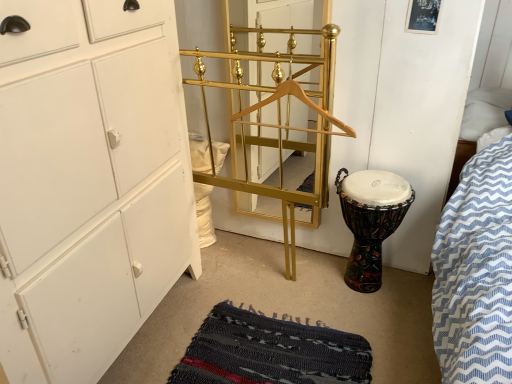
What do you see at coordinates (275, 121) in the screenshot? The width and height of the screenshot is (512, 384). I see `gold metallic coat rack at center` at bounding box center [275, 121].

This screenshot has height=384, width=512. What do you see at coordinates (302, 102) in the screenshot?
I see `wooden hanger at center` at bounding box center [302, 102].

Describe the element at coordinates (280, 28) in the screenshot. I see `gold/metallic coat rack at center` at that location.

This screenshot has width=512, height=384. What do you see at coordinates (367, 238) in the screenshot?
I see `multicolored painted drum at lower right` at bounding box center [367, 238].

At what (x,y) coordinates should I click in order to perform the action: click on rag-textured mat at lower center. Please return your answer as a coordinate pair (x, y). This screenshot has width=512, height=384. Looking at the image, I should click on (270, 352).

Locate an element on the screen. Image resolution: width=512 pixels, height=384 pixels. white matte cabinet at left is located at coordinates (89, 183).

Which is behind, gold metallic coat rack at center or multicolored painted drum at lower right?

multicolored painted drum at lower right is further away from the camera.

You are a GUI agent. You are given a task and a screenshot of the screen. Output one action in this format:
    pyautogui.click(x=<x>, y=<y>)
    Task: Click on the drum on the right of gold metallic coat rack at center
    The height and width of the screenshot is (384, 512).
    Given the screenshot: What is the action you would take?
    pyautogui.click(x=367, y=238)

Is gold metallic coat rack at center thinner than multicolored painted drum at lower right?

Yes.

Locate an element on the screen. This screenshot has width=512, height=384. door above the multicolored painted drum at lower right (from a real-world perspective) is located at coordinates (280, 28).

Which of these two, multicolored painted drum at lower right or gold/metallic coat rack at center, is bigger?

multicolored painted drum at lower right is bigger.

Is gold/metallic coat rack at center located within multicolored painted drum at lower right?

No, gold/metallic coat rack at center is not a part of multicolored painted drum at lower right.

Does multicolored painted drum at lower right have a greater height compared to gold/metallic coat rack at center?

In fact, multicolored painted drum at lower right may be shorter than gold/metallic coat rack at center.

From a real-world perspective, which is physically below, gold metallic coat rack at center or gold/metallic coat rack at center?

In real-world perspective, gold metallic coat rack at center is lower.

Would you say gold metallic coat rack at center is a long distance from gold/metallic coat rack at center?

No.

Which of these two, gold metallic coat rack at center or gold/metallic coat rack at center, is wider?

Wider between the two is gold metallic coat rack at center.

Is gold metallic coat rack at center inside or outside of gold/metallic coat rack at center?

gold metallic coat rack at center is outside gold/metallic coat rack at center.

From the image's perspective, is wooden hanger at center beneath rag-textured mat at lower center?

No, from the image's perspective, wooden hanger at center is not below rag-textured mat at lower center.

Find the location of `hanger on the right of rag-textured mat at lower center`. hanger on the right of rag-textured mat at lower center is located at coordinates [302, 102].

Which is correct: wooden hanger at center is inside rag-textured mat at lower center, or outside of it?

wooden hanger at center is spatially situated outside rag-textured mat at lower center.

Can you confirm if wooden hanger at center is shorter than rag-textured mat at lower center?

No, wooden hanger at center is not shorter than rag-textured mat at lower center.

Does wooden hanger at center appear on the left side of white matte cabinet at left?

Incorrect, wooden hanger at center is not on the left side of white matte cabinet at left.

From the image's perspective, which is below, wooden hanger at center or white matte cabinet at left?

From the image's view, white matte cabinet at left is below.

Would you consider wooden hanger at center to be distant from white matte cabinet at left?

No.

Is rag-textured mat at lower center facing towards white matte cabinet at left?

No, rag-textured mat at lower center is not facing towards white matte cabinet at left.

Considering the positions of point (335, 334) and point (15, 65), is point (335, 334) closer or farther from the camera than point (15, 65)?

Point (335, 334) appears to be farther away from the viewer than point (15, 65).

Considering the sizes of objects rag-textured mat at lower center and white matte cabinet at left in the image provided, who is taller, rag-textured mat at lower center or white matte cabinet at left?

With more height is white matte cabinet at left.

Would you say rag-textured mat at lower center is a long distance from white matte cabinet at left?

rag-textured mat at lower center is actually quite close to white matte cabinet at left.

From the image's perspective, is gold/metallic coat rack at center below multicolored painted drum at lower right?

Actually, gold/metallic coat rack at center appears above multicolored painted drum at lower right in the image.

Do you think gold/metallic coat rack at center is within multicolored painted drum at lower right, or outside of it?

gold/metallic coat rack at center is located beyond the bounds of multicolored painted drum at lower right.

Does gold/metallic coat rack at center turn towards multicolored painted drum at lower right?

No, gold/metallic coat rack at center is not aimed at multicolored painted drum at lower right.

Considering the sizes of objects gold/metallic coat rack at center and multicolored painted drum at lower right in the image provided, who is taller, gold/metallic coat rack at center or multicolored painted drum at lower right?

gold/metallic coat rack at center is taller.

Where is `bunk bed in front of the multicolored painted drum at lower right`? This screenshot has width=512, height=384. bunk bed in front of the multicolored painted drum at lower right is located at coordinates (275, 121).

I want to click on drum beneath the gold/metallic coat rack at center (from a real-world perspective), so click(x=367, y=238).

Looking at the image, which one is located closer to gold/metallic coat rack at center, multicolored painted drum at lower right or white matte cabinet at left?

A: multicolored painted drum at lower right is closer to gold/metallic coat rack at center.

From the image, which object appears to be nearer to gold/metallic coat rack at center, rag-textured mat at lower center or gold metallic coat rack at center?

The object closer to gold/metallic coat rack at center is gold metallic coat rack at center.

Which object lies further to the anchor point white matte cabinet at left, multicolored painted drum at lower right or gold metallic coat rack at center?

Among the two, multicolored painted drum at lower right is located further to white matte cabinet at left.

Looking at the image, which one is located closer to gold/metallic coat rack at center, white matte cabinet at left or multicolored painted drum at lower right?

multicolored painted drum at lower right is positioned closer to the anchor gold/metallic coat rack at center.

Considering their positions, is wooden hanger at center positioned further to gold/metallic coat rack at center than multicolored painted drum at lower right?

multicolored painted drum at lower right is positioned further to the anchor gold/metallic coat rack at center.

In the scene shown: Based on their spatial positions, is gold/metallic coat rack at center or gold metallic coat rack at center closer to wooden hanger at center?

gold metallic coat rack at center lies closer to wooden hanger at center than the other object.

Estimate the real-world distances between objects in this image. Which object is closer to gold metallic coat rack at center, wooden hanger at center or white matte cabinet at left?

wooden hanger at center.

Which object lies further to the anchor point white matte cabinet at left, gold metallic coat rack at center or wooden hanger at center?

Among the two, wooden hanger at center is located further to white matte cabinet at left.

At what (x,y) coordinates should I click in order to perform the action: click on hanger between white matte cabinet at left and multicolored painted drum at lower right in the horizontal direction. Please return your answer as a coordinate pair (x, y). The height and width of the screenshot is (384, 512). Looking at the image, I should click on (302, 102).

You are a GUI agent. You are given a task and a screenshot of the screen. Output one action in this format:
    pyautogui.click(x=<x>, y=<y>)
    Task: Click on the bunk bed between gold/metallic coat rack at center and rag-textured mat at lower center vertically
    The height and width of the screenshot is (384, 512).
    Given the screenshot: What is the action you would take?
    pyautogui.click(x=275, y=121)

You are a GUI agent. You are given a task and a screenshot of the screen. Output one action in this format:
    pyautogui.click(x=<x>, y=<y>)
    Task: Click on the hanger between gold metallic coat rack at center and gold/metallic coat rack at center from front to back
    The image size is (512, 384).
    Given the screenshot: What is the action you would take?
    pyautogui.click(x=302, y=102)

You are a GUI agent. You are given a task and a screenshot of the screen. Output one action in this format:
    pyautogui.click(x=<x>, y=<y>)
    Task: Click on the hanger between gold metallic coat rack at center and multicolored painted drum at lower right in the horizontal direction
    This screenshot has height=384, width=512.
    Given the screenshot: What is the action you would take?
    pyautogui.click(x=302, y=102)